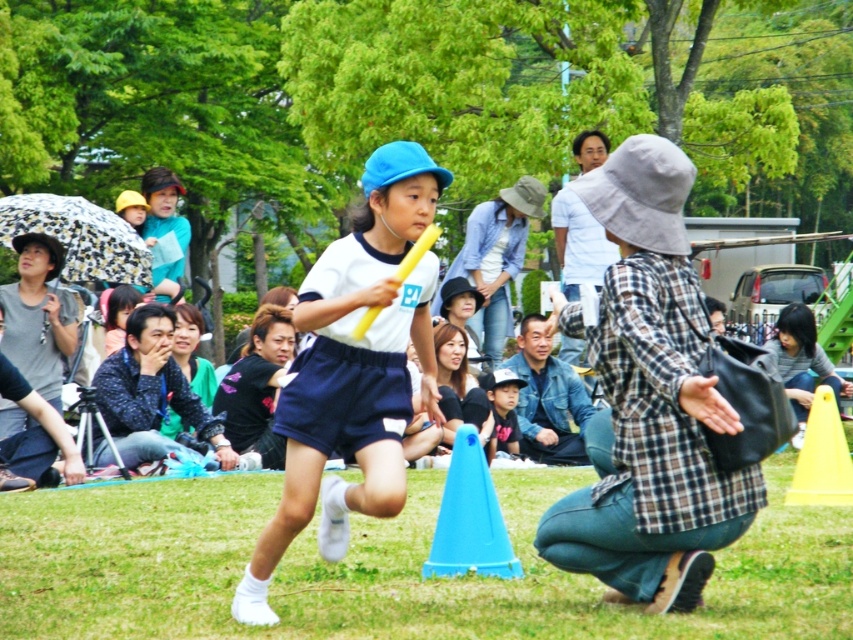
Is green grass at center shorter than blue plastic traffic cone at center?

Correct, green grass at center is not as tall as blue plastic traffic cone at center.

Can you confirm if green grass at center is positioned above blue plastic traffic cone at center?

No, green grass at center is not above blue plastic traffic cone at center.

Which is in front, point (347, 614) or point (490, 564)?

Point (347, 614) is in front.

At what (x,y) coordinates should I click in order to perform the action: click on green grass at center. Please return your answer as a coordinate pair (x, y). Looking at the image, I should click on (381, 566).

Between point (825, 403) and point (480, 384), which one is positioned behind?

Point (480, 384)

Is point (816, 486) positioned in front of point (518, 387)?

Yes, point (816, 486) is closer to viewer.

What do you see at coordinates (822, 458) in the screenshot? I see `yellow plastic traffic cone at lower right` at bounding box center [822, 458].

This screenshot has width=853, height=640. I want to click on yellow plastic traffic cone at lower right, so click(822, 458).

In the scene shown: Is blue plastic traffic cone at center further to the viewer compared to matte black cap at center?

No, it is not.

Between point (471, 444) and point (486, 445), which one is positioned behind?

The point (486, 445) is behind.

Is point (486, 525) positioned before point (492, 394)?

Yes, it is in front of point (492, 394).

The height and width of the screenshot is (640, 853). I want to click on blue plastic traffic cone at center, so click(469, 518).